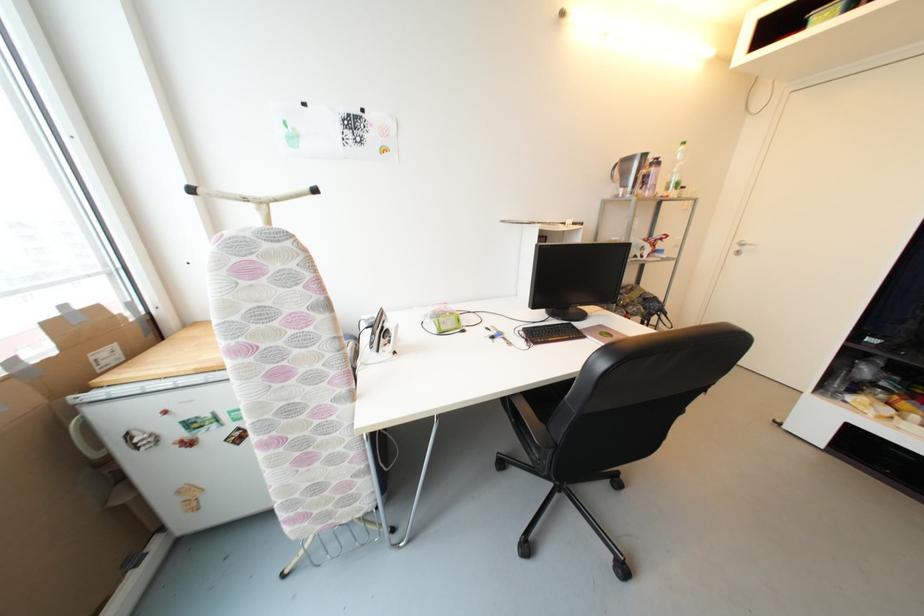
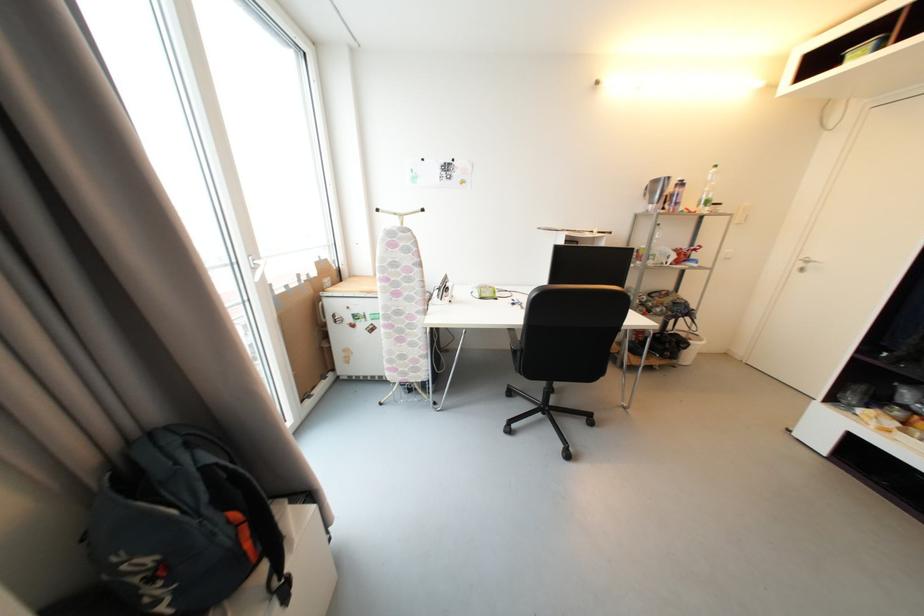
Find the pixel in the second image that matches point 95,411 in the first image.

(330, 302)